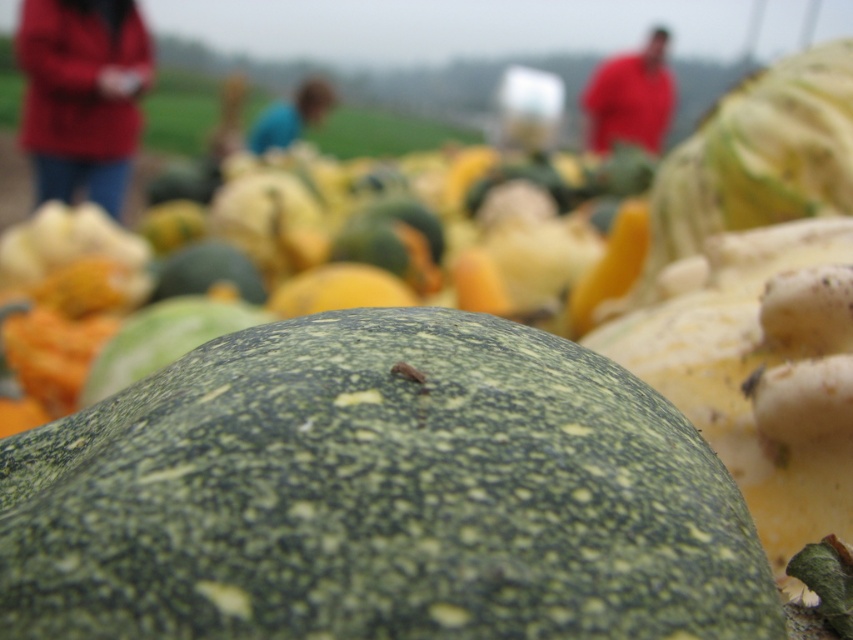
Looking at this image, you are observing a group of people in the background of a still life arrangement of gourds. You notice the matte red jacket at upper left and the blue fabric shirt at center. Which of these two items is positioned higher up in the image?

The matte red jacket at upper left is much taller as blue fabric shirt at center, so the matte red jacket at upper left is positioned higher up in the image.

You are organizing a photo album and need to describe the arrangement of the red cotton shirt at upper right and the blue fabric shirt at center. Which shirt is located to the right of the other?

The red cotton shirt at upper right is positioned on the right side of blue fabric shirt at center, so the red cotton shirt at upper right is to the right of the blue fabric shirt at center.

In the image of gourds and pumpkins, where is the red cotton shirt at upper right located in terms of coordinates?

The red cotton shirt at upper right is located at point coordinates of (630, 97).